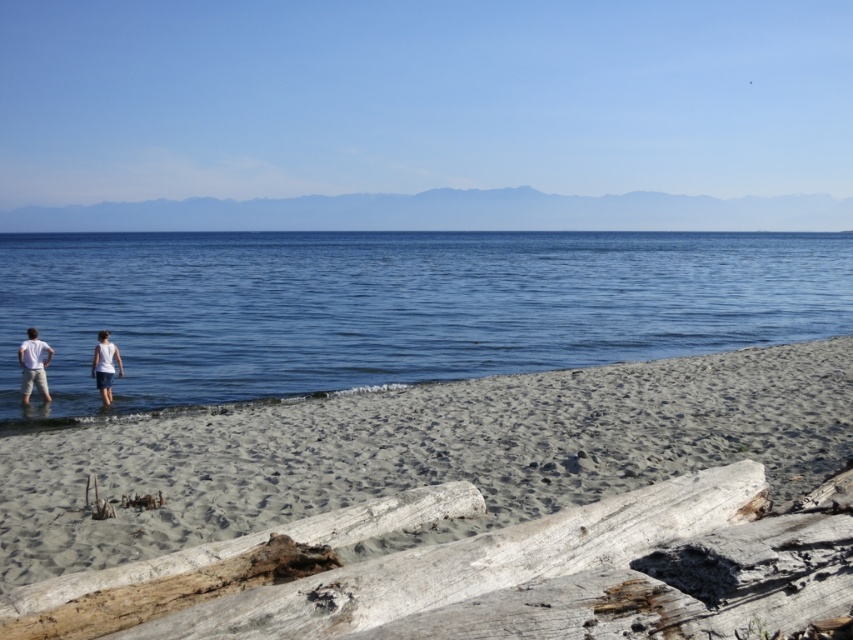
Is point (805, 278) farther from viewer compared to point (105, 388)?

Yes.

What are the coordinates of `blue water at lower left` in the screenshot? It's located at (393, 307).

Between point (70, 284) and point (102, 356), which one is positioned behind?

The point (70, 284) is more distant.

Where is `blue water at lower left`? This screenshot has width=853, height=640. blue water at lower left is located at coordinates (393, 307).

Is the position of weathered wood log at lower center more distant than that of white cotton shirt at center?

No, it is in front of white cotton shirt at center.

Who is higher up, weathered wood log at lower center or white cotton shirt at center?

white cotton shirt at center is higher up.

Does point (401, 618) come closer to viewer compared to point (49, 349)?

Yes.

Identify the location of weathered wood log at lower center. (488, 573).

Can you confirm if blue water at lower left is taller than light beige sand at lower left?

Yes.

Is blue water at lower left positioned before light beige sand at lower left?

No, it is behind light beige sand at lower left.

Does point (469, 356) lie in front of point (556, 433)?

That is False.

Locate an element on the screen. blue water at lower left is located at coordinates (393, 307).